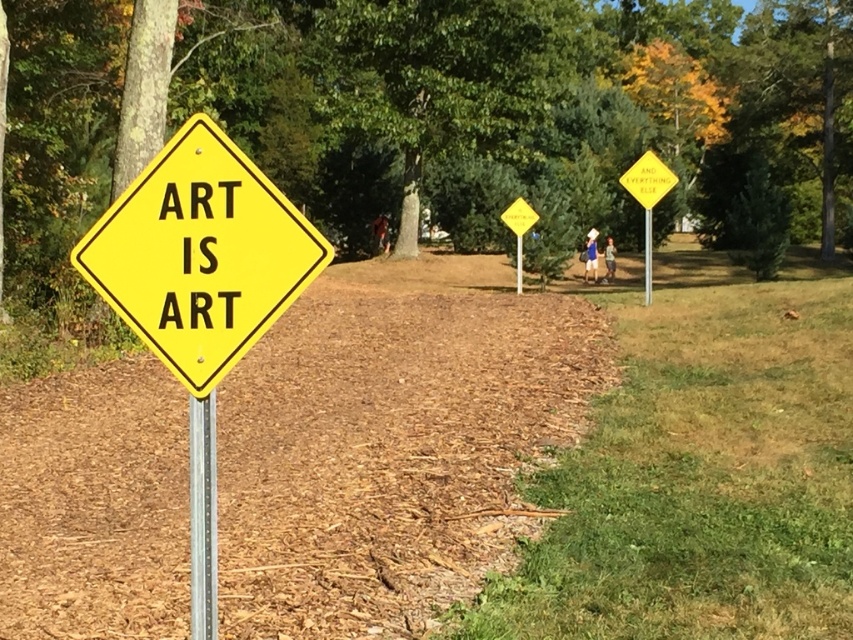
Does yellow metal pole at center have a smaller size compared to yellow metal signpost at center?

No.

Is point (647, 269) farther from viewer compared to point (518, 276)?

No, (647, 269) is in front of (518, 276).

At what (x,y) coordinates should I click in order to perform the action: click on yellow metal pole at center. Please return your answer as a coordinate pair (x, y). Looking at the image, I should click on (647, 256).

Can you confirm if yellow diamond-shaped sign at left is positioned below yellow metal signpost at center?

Yes.

Describe the element at coordinates (200, 253) in the screenshot. I see `yellow diamond-shaped sign at left` at that location.

Locate an element on the screen. yellow diamond-shaped sign at left is located at coordinates (200, 253).

Does yellow diamond-shaped sign at left appear under metallic silver pole at center?

No, yellow diamond-shaped sign at left is not below metallic silver pole at center.

Consider the image. Between yellow diamond-shaped sign at left and metallic silver pole at center, which one has more height?

yellow diamond-shaped sign at left is taller.

Which is in front, point (242, 324) or point (207, 529)?

Positioned in front is point (242, 324).

Where is `yellow diamond-shaped sign at left`? This screenshot has width=853, height=640. yellow diamond-shaped sign at left is located at coordinates (200, 253).